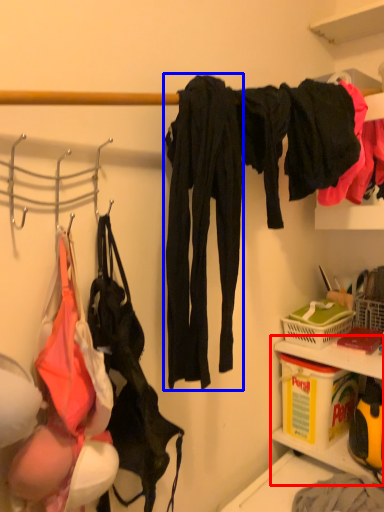
Question: Which object is further to the camera taking this photo, cabinet (highlighted by a red box) or clothing (highlighted by a blue box)?

Choices:
 (A) cabinet
 (B) clothing

Answer: (A)